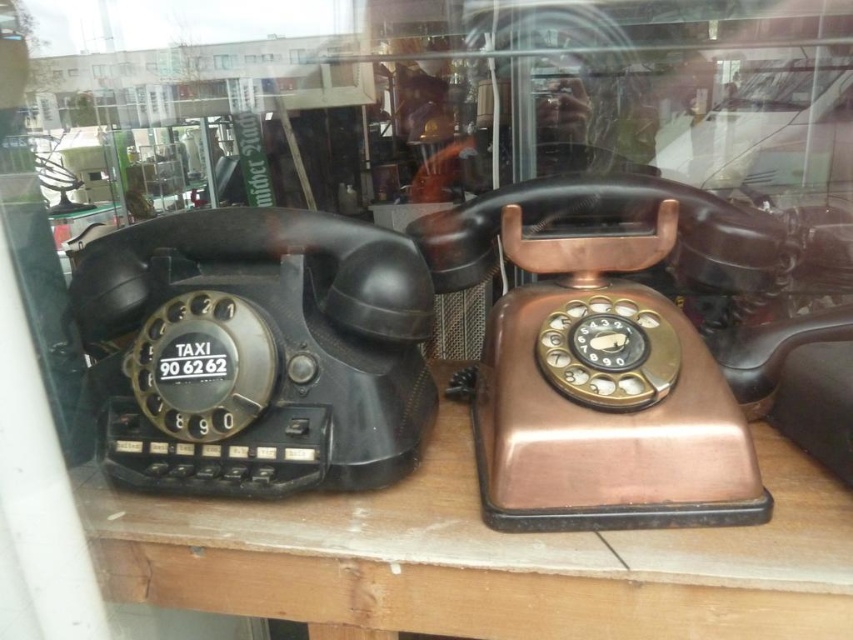
You are a customer in a vintage shop and want to place a small gift card on the brown wood table at center so it doesn not fall off. Considering the height of the copper metallic telephone at center, will the gift card stay stable on the table?

The brown wood table at center has a lesser height compared to copper metallic telephone at center, so the gift card may not stay stable because the telephone is taller and could potentially knock it over if moved.

You are a customer in the shop and want to know which telephone is taller. Can you tell me which one is taller between the matte black telephone at left and the copper metallic telephone at center?

The matte black telephone at left is not as tall as the copper metallic telephone at center, so the copper metallic telephone at center is taller.

You are a customer in a vintage shop and want to buy the matte black telephone at left and the copper metallic telephone at center. You need to know which one is closer to the edge of the wooden surface to avoid breakage. Can you tell me which telephone is placed closer to the edge?

The matte black telephone at left is positioned over the copper metallic telephone at center, so the matte black telephone at left is closer to the edge of the wooden surface.